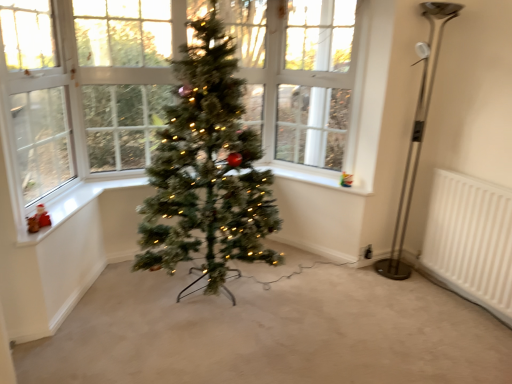
Question: Considering their positions, is clear glass window at left, which is the second window screen in back-to-front order, located in front of or behind clear glass window at upper center, the second window screen positioned from the left?

Choices:
 (A) behind
 (B) front

Answer: (B)

Question: Is clear glass window at left, which is the second window screen in back-to-front order, to the left or to the right of clear glass window at upper center, the second window screen positioned from the left, in the image?

Choices:
 (A) right
 (B) left

Answer: (B)

Question: Considering the real-world distances, which object is farthest from the white painted wood at lower left, which is the 1th window sill from left to right?

Choices:
 (A) green artificial christmas tree at center
 (B) polished metal floor lamp at right
 (C) clear glass window at upper center, the second window screen viewed from the front
 (D) clear glass window at left, which ranks as the first window screen in left-to-right order
 (E) white plastic at upper center, acting as the second window sill starting from the left

Answer: (B)

Question: Based on their relative distances, which object is nearer to the green artificial christmas tree at center?

Choices:
 (A) clear glass window at left, which is the second window screen from right to left
 (B) clear glass window at upper center, the second window screen positioned from the left
 (C) white plastic at upper center, which is counted as the 1th window sill, starting from the back
 (D) polished metal floor lamp at right
 (E) white painted wood at lower left, which is the 1th window sill from left to right

Answer: (E)